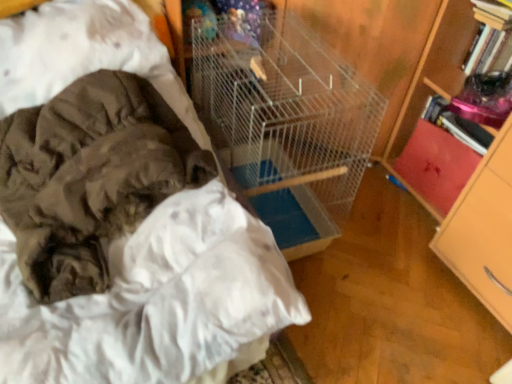
What is the approximate width of camouflage fabric blanket at left?

It is 23.78 inches.

Image resolution: width=512 pixels, height=384 pixels. What do you see at coordinates (469, 176) in the screenshot?
I see `wooden bookcase at right` at bounding box center [469, 176].

The width and height of the screenshot is (512, 384). Describe the element at coordinates (436, 165) in the screenshot. I see `red leather book at right, which appears as the second drawer when viewed from the front` at that location.

Find the location of a particular element. The image size is (512, 384). camouflage fabric blanket at left is located at coordinates 89,177.

Can you tell me how much wooden bookcase at right and red leather book at right, placed as the 1th drawer when sorted from back to front, differ in facing direction?

There is a 2.58-degree angle between the facing directions of wooden bookcase at right and red leather book at right, placed as the 1th drawer when sorted from back to front.

Between point (464, 269) and point (452, 185), which one is positioned behind?

The point (452, 185) is more distant.

How much distance is there between wooden bookcase at right and red leather book at right, placed as the 1th drawer when sorted from back to front?

5.93 inches.

From a real-world perspective, is wooden bookcase at right above or below red leather book at right, placed as the 1th drawer when sorted from back to front?

wooden bookcase at right is above red leather book at right, placed as the 1th drawer when sorted from back to front.

Which object is closer to the camera, white wire birdcage at center or red leather book at right, which appears as the second drawer when viewed from the front?

Positioned in front is white wire birdcage at center.

Does white wire birdcage at center have a greater height compared to red leather book at right, placed as the 1th drawer when sorted from back to front?

Indeed, white wire birdcage at center has a greater height compared to red leather book at right, placed as the 1th drawer when sorted from back to front.

I want to click on drawer behind the white wire birdcage at center, so click(x=436, y=165).

Who is smaller, white wire birdcage at center or red leather book at right, placed as the 1th drawer when sorted from back to front?

Smaller between the two is red leather book at right, placed as the 1th drawer when sorted from back to front.

Considering the relative sizes of wooden bookcase at right and wooden drawer at right, the 1th drawer from the front, in the image provided, is wooden bookcase at right taller than wooden drawer at right, the 1th drawer from the front,?

Yes.

Is wooden drawer at right, the 1th drawer from the front, at the back of wooden bookcase at right?

wooden bookcase at right does not have its back to wooden drawer at right, the 1th drawer from the front.

Which point is more forward, (446, 223) or (450, 267)?

Positioned in front is point (446, 223).

Where is `drawer on the right side of wooden bookcase at right`? drawer on the right side of wooden bookcase at right is located at coordinates (481, 242).

Between wooden bookcase at right and camouflage fabric blanket at left, which one has more height?

Standing taller between the two is wooden bookcase at right.

This screenshot has width=512, height=384. In order to click on bookcase above the camouflage fabric blanket at left (from the image's perspective) in this screenshot , I will do `click(469, 176)`.

Is point (421, 89) positioned in front of point (61, 246)?

No.

Considering the sizes of objects wooden drawer at right, the 1th drawer from the front, and camouflage fabric blanket at left in the image provided, who is wider, wooden drawer at right, the 1th drawer from the front, or camouflage fabric blanket at left?

camouflage fabric blanket at left.

Is wooden drawer at right, the 2th drawer from the back, taller or shorter than camouflage fabric blanket at left?

Clearly, wooden drawer at right, the 2th drawer from the back, is taller compared to camouflage fabric blanket at left.

Image resolution: width=512 pixels, height=384 pixels. There is a wooden drawer at right, the 2th drawer from the back. What are the coordinates of `clothing above it (from a real-world perspective)` in the screenshot? It's located at (89, 177).

Which object is closer to the camera, wooden drawer at right, the 1th drawer from the front, or camouflage fabric blanket at left?

camouflage fabric blanket at left is more forward.

Is red leather book at right, which appears as the second drawer when viewed from the front, wider or thinner than wooden bookcase at right?

red leather book at right, which appears as the second drawer when viewed from the front, is thinner than wooden bookcase at right.

Could wooden bookcase at right be considered to be inside red leather book at right, placed as the 1th drawer when sorted from back to front?

That's incorrect, wooden bookcase at right is not inside red leather book at right, placed as the 1th drawer when sorted from back to front.

Locate an element on the screen. The width and height of the screenshot is (512, 384). bookcase above the red leather book at right, placed as the 1th drawer when sorted from back to front (from the image's perspective) is located at coordinates (469, 176).

Between point (468, 154) and point (426, 201), which one is positioned behind?

The point (426, 201) is behind.

Could you tell me if camouflage fabric blanket at left is facing white wire birdcage at center?

No, camouflage fabric blanket at left is not turned towards white wire birdcage at center.

From the image's perspective, who appears lower, camouflage fabric blanket at left or white wire birdcage at center?

camouflage fabric blanket at left.

Considering the relative sizes of camouflage fabric blanket at left and white wire birdcage at center in the image provided, is camouflage fabric blanket at left smaller than white wire birdcage at center?

Yes, camouflage fabric blanket at left is smaller than white wire birdcage at center.

Does point (77, 89) lie behind point (217, 67)?

No, (77, 89) is closer to viewer.

At what (x,y) coordinates should I click in order to perform the action: click on bookcase in front of the red leather book at right, placed as the 1th drawer when sorted from back to front. Please return your answer as a coordinate pair (x, y). The width and height of the screenshot is (512, 384). Looking at the image, I should click on (469, 176).

Where is `drawer below the white wire birdcage at center (from a real-world perspective)`? This screenshot has width=512, height=384. drawer below the white wire birdcage at center (from a real-world perspective) is located at coordinates pyautogui.click(x=436, y=165).

Looking at the image, which one is located closer to red leather book at right, which appears as the second drawer when viewed from the front, camouflage fabric blanket at left or white wire birdcage at center?

white wire birdcage at center is positioned closer to the anchor red leather book at right, which appears as the second drawer when viewed from the front.

Based on the photo, estimate the real-world distances between objects in this image. Which object is closer to white wire birdcage at center, wooden bookcase at right or red leather book at right, which appears as the second drawer when viewed from the front?

wooden bookcase at right lies closer to white wire birdcage at center than the other object.

When comparing their distances from red leather book at right, which appears as the second drawer when viewed from the front, does wooden bookcase at right or white wire birdcage at center seem closer?

wooden bookcase at right lies closer to red leather book at right, which appears as the second drawer when viewed from the front, than the other object.

Estimate the real-world distances between objects in this image. Which object is closer to wooden drawer at right, the 1th drawer from the front, camouflage fabric blanket at left or wooden bookcase at right?

wooden bookcase at right.

When comparing their distances from white wire birdcage at center, does camouflage fabric blanket at left or wooden bookcase at right seem further?

Among the two, wooden bookcase at right is located further to white wire birdcage at center.

Which object lies nearer to the anchor point camouflage fabric blanket at left, wooden drawer at right, the 2th drawer from the back, or red leather book at right, placed as the 1th drawer when sorted from back to front?

The object closer to camouflage fabric blanket at left is wooden drawer at right, the 2th drawer from the back.

Which object lies further to the anchor point wooden drawer at right, the 1th drawer from the front, red leather book at right, which appears as the second drawer when viewed from the front, or wooden bookcase at right?

red leather book at right, which appears as the second drawer when viewed from the front.

Which object lies nearer to the anchor point wooden bookcase at right, red leather book at right, placed as the 1th drawer when sorted from back to front, or white wire birdcage at center?

Among the two, red leather book at right, placed as the 1th drawer when sorted from back to front, is located nearer to wooden bookcase at right.

This screenshot has height=384, width=512. In order to click on drawer between camouflage fabric blanket at left and wooden drawer at right, the 1th drawer from the front, from left to right in this screenshot , I will do `click(436, 165)`.

Identify the location of drawer between camouflage fabric blanket at left and wooden bookcase at right from left to right. The width and height of the screenshot is (512, 384). (436, 165).

This screenshot has width=512, height=384. Identify the location of bookcase between white wire birdcage at center and wooden drawer at right, the 2th drawer from the back, from left to right. [469, 176].

Where is `drawer between white wire birdcage at center and wooden drawer at right, the 2th drawer from the back, from left to right`? Image resolution: width=512 pixels, height=384 pixels. drawer between white wire birdcage at center and wooden drawer at right, the 2th drawer from the back, from left to right is located at coordinates (x=436, y=165).